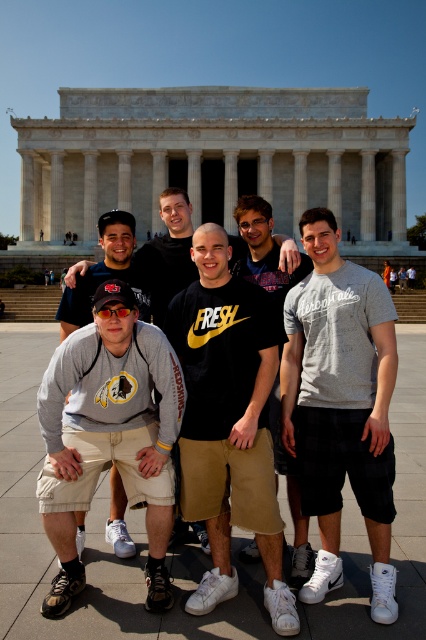
You are standing in front of the Lincoln Memorial and want to take a photo of two specific points in the scene. The first point is at coordinates point (192, 524) and the second point is at point (124, 502). Which point is closer to your current position?

Point (192, 524) is closer to the camera than point (124, 502).